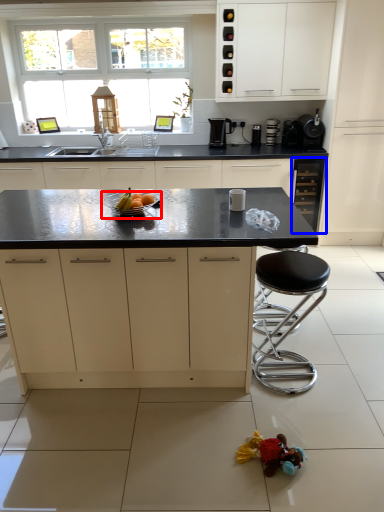
Question: Which of the following is the closest to the observer, bowl (highlighted by a red box) or cabinetry (highlighted by a blue box)?

Choices:
 (A) bowl
 (B) cabinetry

Answer: (A)